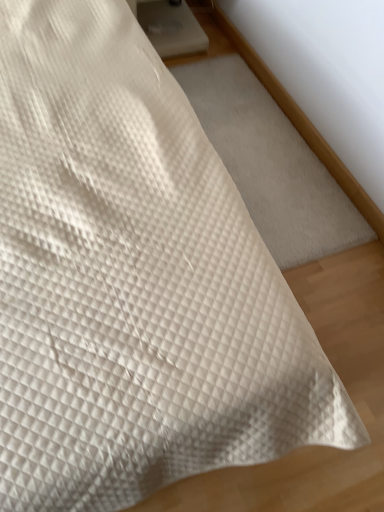
Where is `white matte table at upper center`? white matte table at upper center is located at coordinates (171, 28).

What do you see at coordinates (171, 28) in the screenshot? This screenshot has height=512, width=384. I see `white matte table at upper center` at bounding box center [171, 28].

Where is `white matte table at upper center`? This screenshot has width=384, height=512. white matte table at upper center is located at coordinates (171, 28).